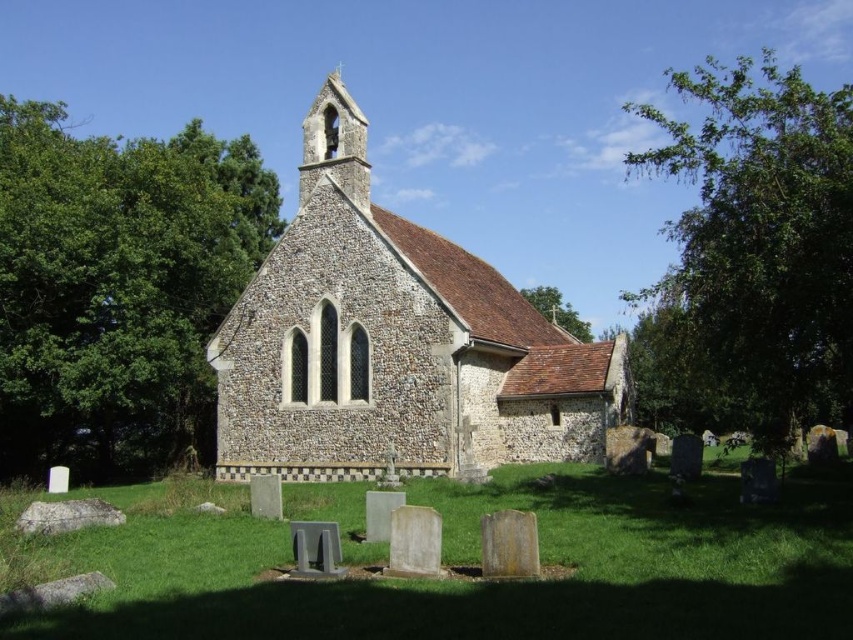
You are standing at the entrance of the church and see two points marked on the ground. The first point is at coordinate point(x=294, y=272) and the second point is at point(x=550, y=301). Which point is closer to you?

Point(x=294, y=272) is in front of point(x=550, y=301), so it is closer to you.

You are standing in front of the brown stone church at center and looking up at the brown shingles roof at upper center. Which object is wider from your perspective?

The brown stone church at center might be wider than brown shingles roof at upper center according to the description.